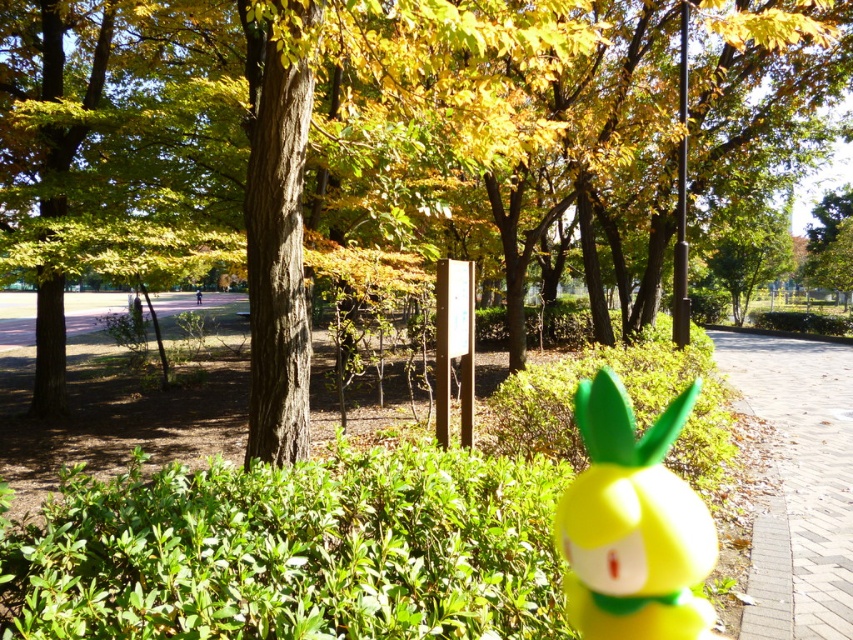
Is green matte tree at center positioned in front of yellow matte toy at center?

No, green matte tree at center is further to the viewer.

Is green matte tree at center shorter than yellow matte toy at center?

No.

The width and height of the screenshot is (853, 640). What do you see at coordinates (328, 147) in the screenshot?
I see `green matte tree at center` at bounding box center [328, 147].

Find the location of a particular element. The width and height of the screenshot is (853, 640). green matte tree at center is located at coordinates (328, 147).

Describe the element at coordinates (633, 524) in the screenshot. Image resolution: width=853 pixels, height=640 pixels. I see `yellow matte toy at center` at that location.

At what (x,y) coordinates should I click in order to perform the action: click on yellow matte toy at center. Please return your answer as a coordinate pair (x, y). Looking at the image, I should click on (633, 524).

Does point (379, 209) come farther from viewer compared to point (817, 369)?

No, it is not.

Which is above, green matte tree at center or brick paved path at lower right?

Positioned higher is green matte tree at center.

Is point (379, 49) farther from camera compared to point (810, 449)?

That is False.

At what (x,y) coordinates should I click in order to perform the action: click on green matte tree at center. Please return your answer as a coordinate pair (x, y). This screenshot has width=853, height=640. Looking at the image, I should click on (328, 147).